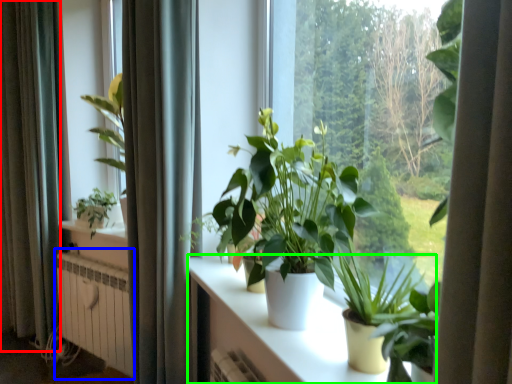
Question: Which object is the farthest from curtain (highlighted by a red box)? Choose among these: radiator (highlighted by a blue box) or table (highlighted by a green box).

Choices:
 (A) radiator
 (B) table

Answer: (B)